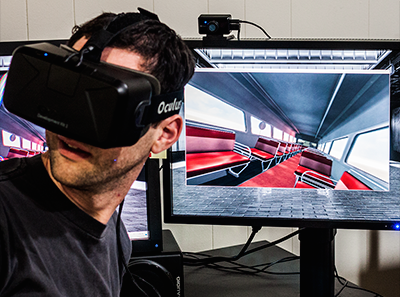
Identify the location of electric cords. (203, 258), (242, 251), (264, 250), (266, 263), (253, 24).